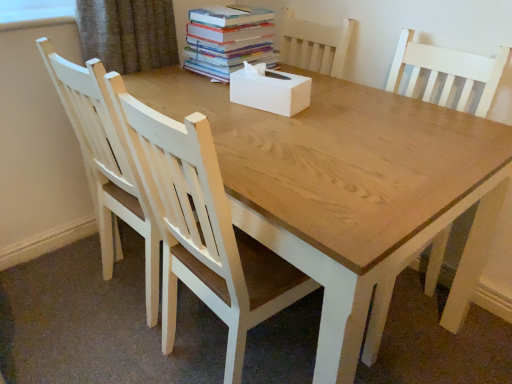
Identify the location of free location to the left of white wood chair at left, which is the 1th chair from left to right. This screenshot has height=384, width=512. (56, 287).